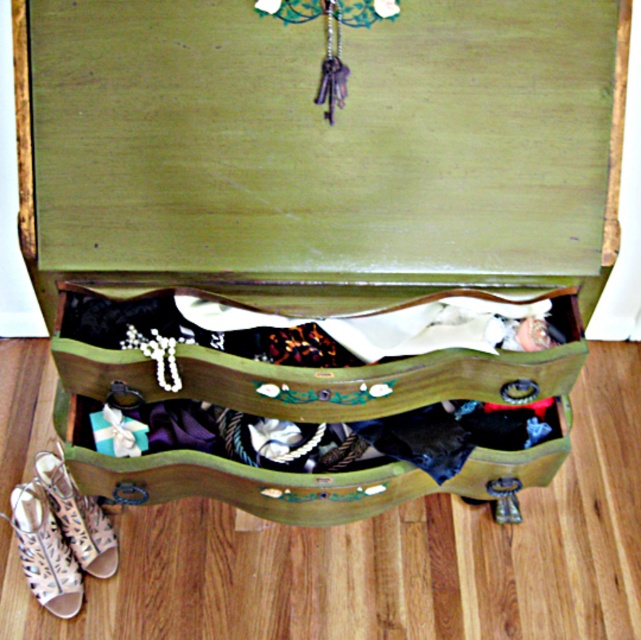
Question: Which object is positioned closest to the white lace-up sandal at lower left?

Choices:
 (A) green painted wood drawer at center
 (B) leather/textured sandal at lower left

Answer: (B)

Question: Does green painted wood drawer at center have a lesser width compared to leather/textured sandal at lower left?

Choices:
 (A) yes
 (B) no

Answer: (B)

Question: Which object is the farthest from the green painted wood drawer at center?

Choices:
 (A) leather/textured sandal at lower left
 (B) white lace-up sandal at lower left

Answer: (B)

Question: Which object appears farthest from the camera in this image?

Choices:
 (A) green painted wood drawer at center
 (B) white lace-up sandal at lower left
 (C) leather/textured sandal at lower left

Answer: (C)

Question: Can you confirm if white lace-up sandal at lower left is wider than leather/textured sandal at lower left?

Choices:
 (A) yes
 (B) no

Answer: (A)

Question: Is the position of white lace-up sandal at lower left less distant than that of leather/textured sandal at lower left?

Choices:
 (A) yes
 (B) no

Answer: (A)